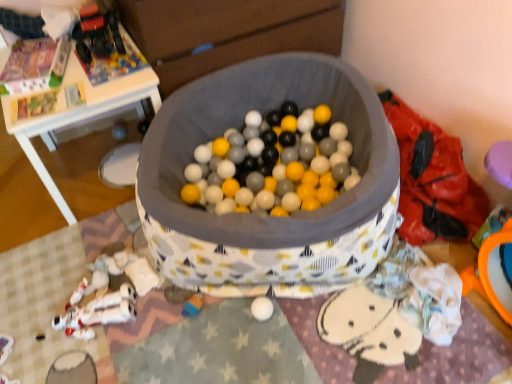
This screenshot has width=512, height=384. What are the coordinates of `vacant area that is situated to the right of rubberized plastic toy at lower center, the fourth toy viewed from the top` in the screenshot? It's located at (233, 321).